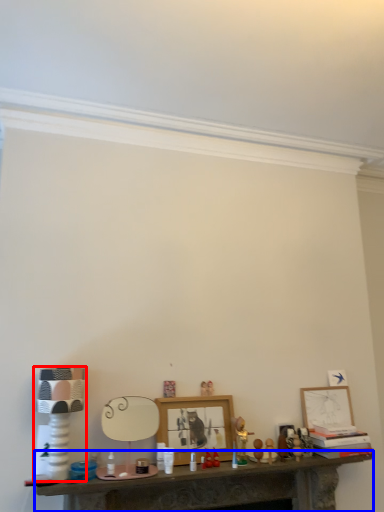
Question: Which object is further to the camera taking this photo, lamp (highlighted by a red box) or table (highlighted by a blue box)?

Choices:
 (A) lamp
 (B) table

Answer: (A)